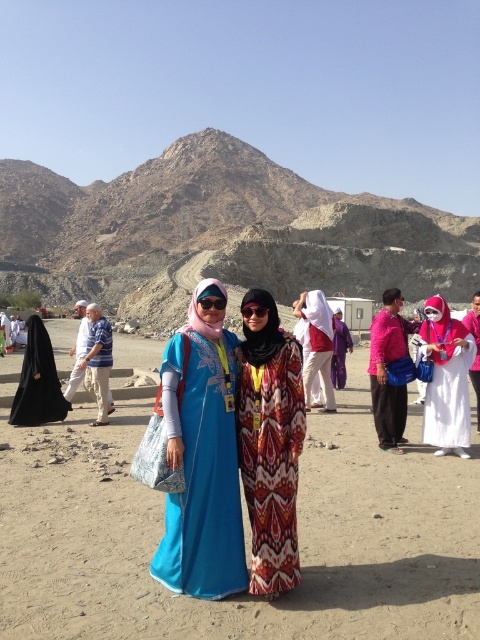
Question: Which point is closer to the camera taking this photo?

Choices:
 (A) (55, 396)
 (B) (251, 563)
 (C) (436, 348)

Answer: (B)

Question: Observing the image, what is the correct spatial positioning of printed fabric dress at center in reference to matte white dress at center?

Choices:
 (A) below
 (B) above

Answer: (A)

Question: Among these objects, which one is nearest to the camera?

Choices:
 (A) blue satin dress at center
 (B) black fabric at left

Answer: (A)

Question: Is blue satin dress at center wider than printed fabric dress at center?

Choices:
 (A) no
 (B) yes

Answer: (B)

Question: Which point is farther to the camera?

Choices:
 (A) (407, 500)
 (B) (308, 385)

Answer: (B)

Question: Can you confirm if blue satin dress at center is positioned to the left of pink fabric bag at center-right?

Choices:
 (A) no
 (B) yes

Answer: (B)